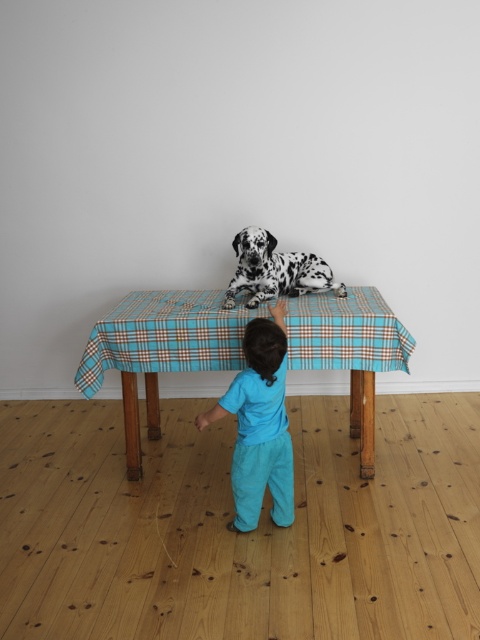
Image resolution: width=480 pixels, height=640 pixels. I want to click on blue plaid tablecloth at center, so click(158, 349).

Between point (368, 333) and point (287, 289), which one is positioned in front?

Point (368, 333)

Locate an element on the screen. The image size is (480, 640). blue plaid tablecloth at center is located at coordinates pos(158,349).

Can you confirm if turquoise cotton pants at center is bigger than spotted fur dog at center?

Indeed, turquoise cotton pants at center has a larger size compared to spotted fur dog at center.

Who is more forward, (284, 326) or (275, 273)?

Point (284, 326) is in front.

Between point (241, 472) and point (324, 288), which one is positioned in front?

Positioned in front is point (241, 472).

Where is `turquoise cotton pants at center`? The width and height of the screenshot is (480, 640). turquoise cotton pants at center is located at coordinates (260, 424).

Is blue plaid tablecloth at center bigger than turquoise cotton pants at center?

Indeed, blue plaid tablecloth at center has a larger size compared to turquoise cotton pants at center.

Is blue plaid tablecloth at center taller than turquoise cotton pants at center?

No, blue plaid tablecloth at center is not taller than turquoise cotton pants at center.

You are a GUI agent. You are given a task and a screenshot of the screen. Output one action in this format:
    pyautogui.click(x=<x>, y=<y>)
    Task: Click on the blue plaid tablecloth at center
    Image resolution: width=480 pixels, height=640 pixels.
    Given the screenshot: What is the action you would take?
    pyautogui.click(x=158, y=349)